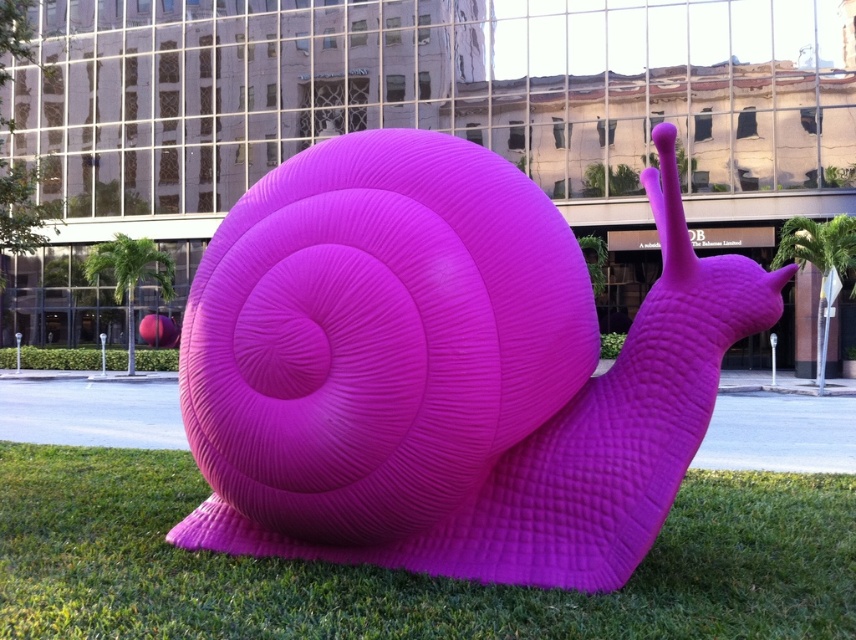
Does matte plastic snail at center appear on the right side of green grass at center?

In fact, matte plastic snail at center is to the left of green grass at center.

Who is more forward, (589, 444) or (670, 538)?

Point (589, 444) is in front.

Between point (581, 456) and point (195, 484), which one is positioned behind?

The point (195, 484) is behind.

Find the location of a particular element. The width and height of the screenshot is (856, 640). matte plastic snail at center is located at coordinates (444, 369).